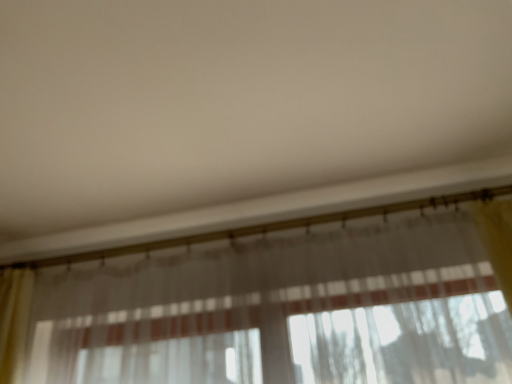
Question: Should I look upward or downward to see translucent fabric curtain at center?

Choices:
 (A) down
 (B) up

Answer: (A)